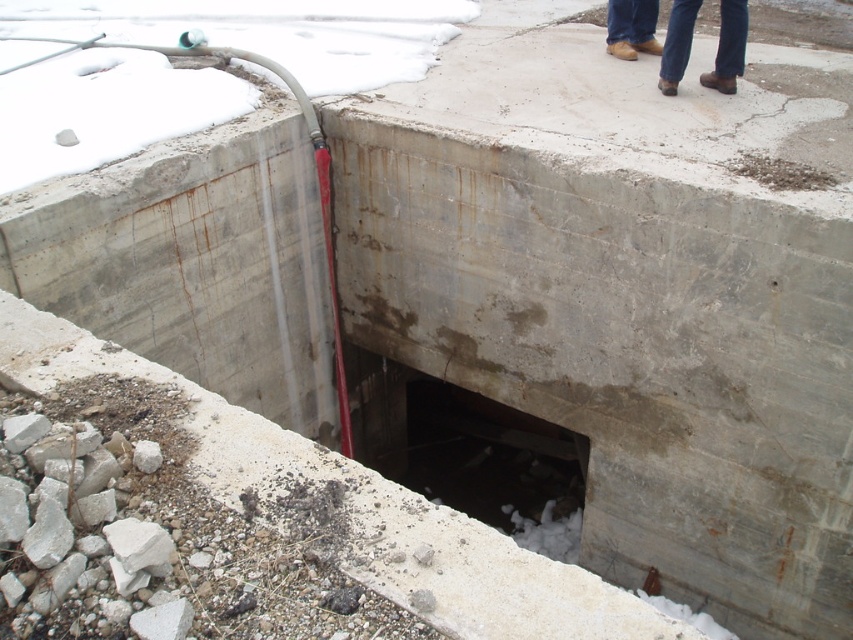
You are a construction worker standing near the dark concrete hole at center and brown leather shoes at upper center. You need to place a safety barrier around the hole. Which object should you prioritize placing the barrier around?

The dark concrete hole at center is larger in size than the brown leather shoes at upper center, so you should prioritize placing the safety barrier around the dark concrete hole at center to ensure proper coverage and safety.

You are standing at the origin point of the image. Where is the dark concrete hole at center located in terms of coordinates?

The dark concrete hole at center is located at coordinates point (468,452).

You are standing at the point marked as point (468, 452) in the image. What is directly below you in the scene?

The dark concrete hole at center is located at point (468, 452), so directly below you would be the dark concrete hole at center.